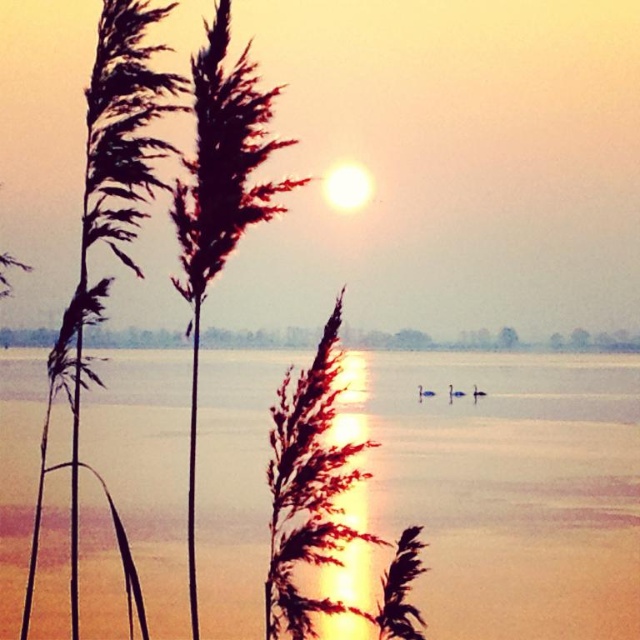
Can you confirm if brown fuzzy reed at left is wider than smooth water at center?

Incorrect, brown fuzzy reed at left's width does not surpass smooth water at center's.

Can you confirm if brown fuzzy reed at left is positioned above smooth water at center?

Yes.

Find the location of a particular element. The width and height of the screenshot is (640, 640). brown fuzzy reed at left is located at coordinates (220, 195).

Which is below, transparent water at center or smooth water at center?

transparent water at center is lower down.

Who is higher up, transparent water at center or smooth water at center?

Positioned higher is smooth water at center.

Find the location of `transparent water at center`. transparent water at center is located at coordinates (506, 486).

Is silvery reeds at left bigger than brown fuzzy reed at left?

Indeed, silvery reeds at left has a larger size compared to brown fuzzy reed at left.

Can you confirm if silvery reeds at left is smaller than brown fuzzy reed at left?

No, silvery reeds at left is not smaller than brown fuzzy reed at left.

Image resolution: width=640 pixels, height=640 pixels. In order to click on silvery reeds at left in this screenshot , I will do `click(106, 211)`.

You are a GUI agent. You are given a task and a screenshot of the screen. Output one action in this format:
    pyautogui.click(x=<x>, y=<y>)
    Task: Click on the silvery reeds at left
    This screenshot has height=640, width=640.
    Given the screenshot: What is the action you would take?
    pyautogui.click(x=106, y=211)